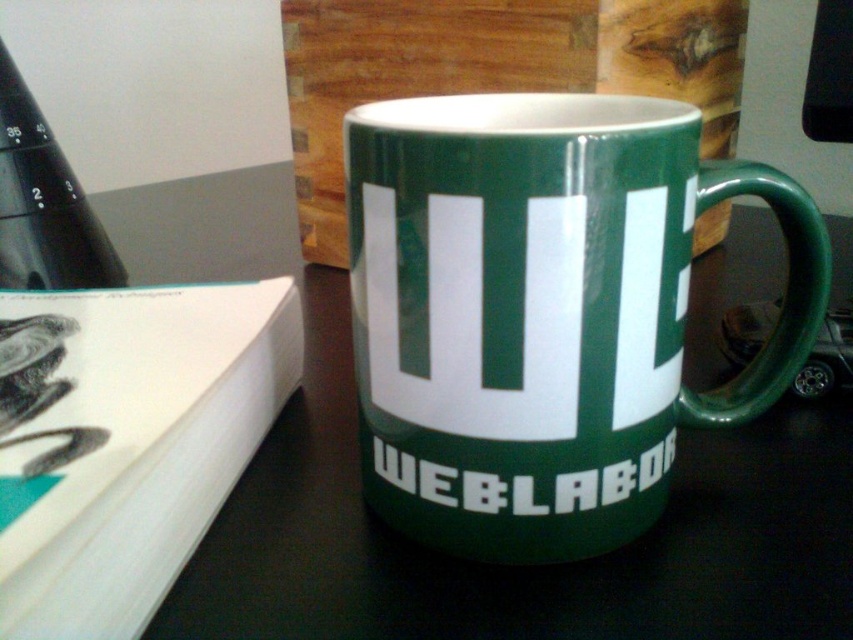
You are setting up a small workspace and need to ensure that your green glossy mug at center doesn not tip over onto the green glossy table at center. Considering their heights, which object is shorter and thus less likely to cause an overflow if filled to the brim?

The green glossy mug at center is shorter than the green glossy table at center, so it is less likely to cause an overflow if filled to the brim because its height is lesser.

Based on the photo, you are organizing items on a desk and need to place a new object between the green glossy mug at center and the green glossy table at center. Is there enough space between them to fit a 10 cm wide object?

The green glossy mug at center is positioned on the left side of green glossy table at center, but the distance between them isn t specified in the objects description. Therefore, it s impossible to determine if a 10 cm wide object can fit between them based on the provided information.

You are organizing a small event and need to place a decorative item on the green glossy table at center. Considering the size of the green glossy mug at center, will it fit comfortably on the table without overcrowding?

The green glossy mug at center occupies less space than the green glossy table at center, so it will fit comfortably on the table without overcrowding.